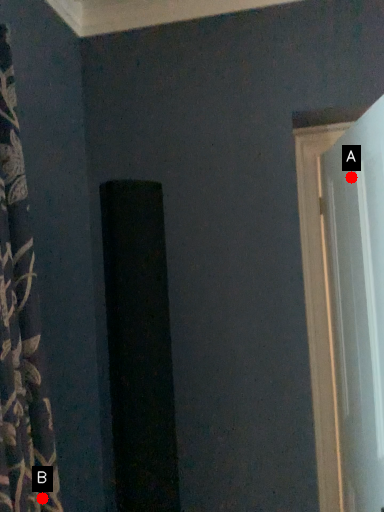
Question: Two points are circled on the image, labeled by A and B beside each circle. Which of the following is the closest to the observer?

Choices:
 (A) A is closer
 (B) B is closer

Answer: (B)